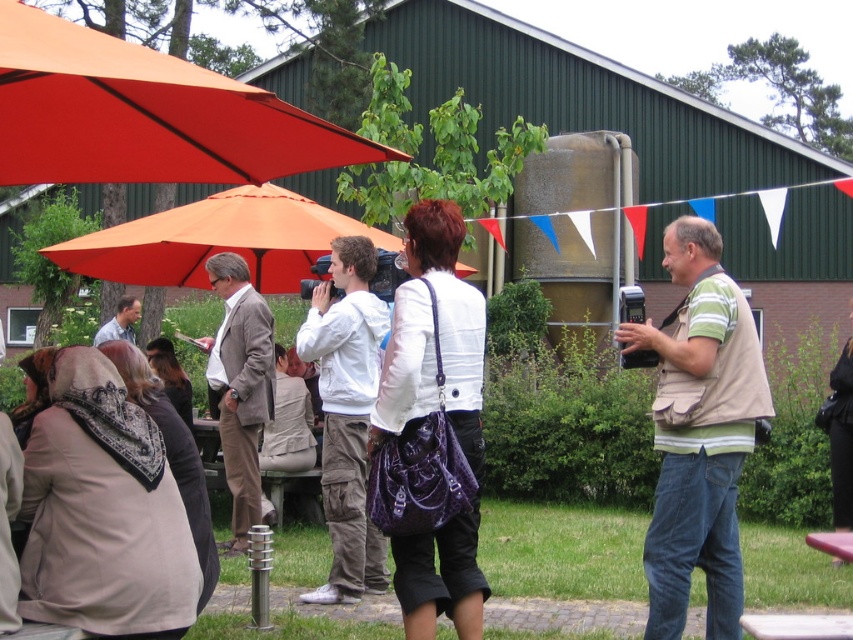
You are at the outdoor gathering and want to move from the orange fabric canopy at upper left to the white cotton hoodie at center. Which direction should you move to reach it?

To move from the orange fabric canopy at upper left to the white cotton hoodie at center, you should move to the right since the orange fabric canopy at upper left is positioned to the left of the white cotton hoodie at center.

You are a photographer at the event and want to take a photo of the white cotton hoodie at center without the orange fabric canopy at upper left casting a shadow on it. How should you position yourself relative to the canopy?

Move to the side opposite the orange fabric canopy at upper left so that the hoodie at center is no longer under it.